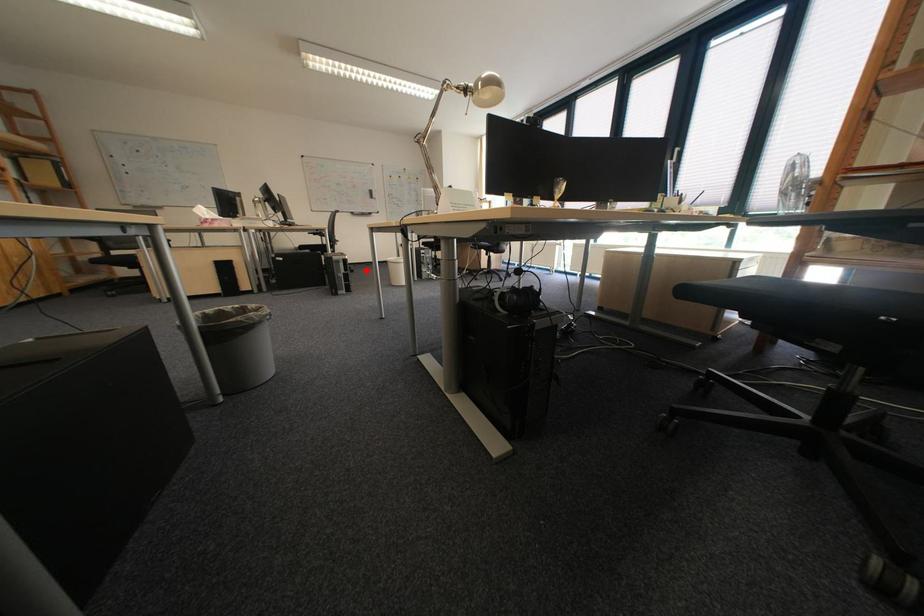
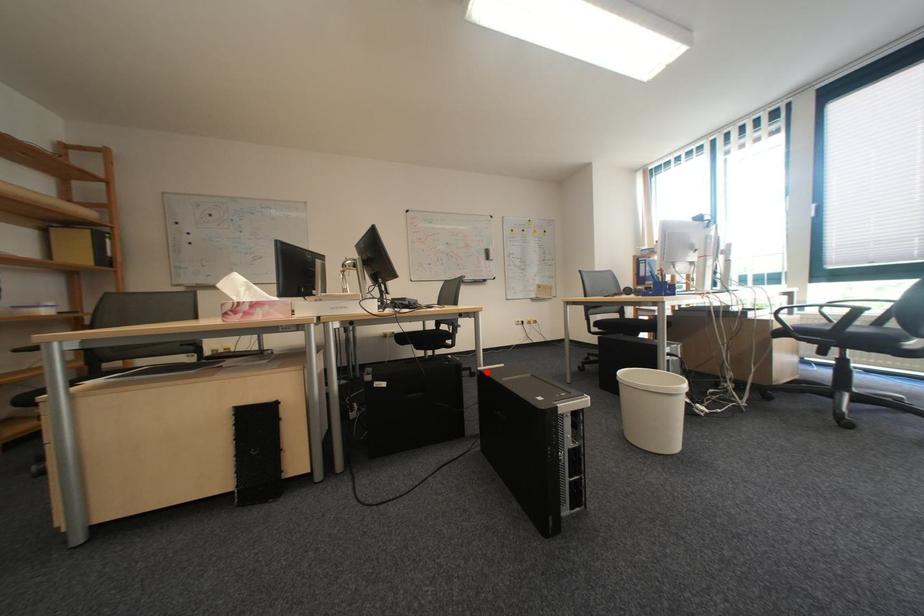
I am providing you with two images of the same scene from different viewpoints. A red point is marked on the first image and another point is marked on the second image. Are the points marked in image1 and image2 representing the same 3D position?

Yes